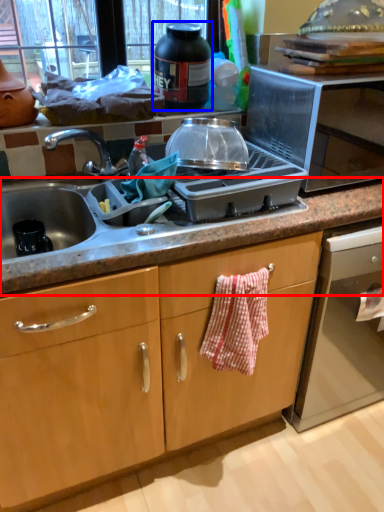
Question: Which point is further to the camera, countertop (highlighted by a red box) or kitchen appliance (highlighted by a blue box)?

Choices:
 (A) countertop
 (B) kitchen appliance

Answer: (B)